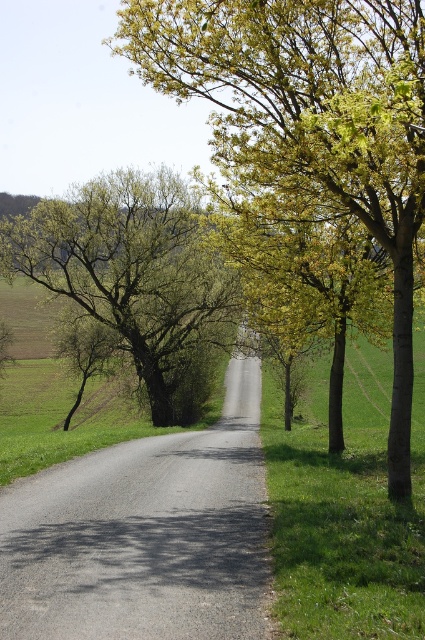
Which is above, green leafy tree at center or green leafy tree at left?

green leafy tree at center

Can you confirm if green leafy tree at center is positioned to the left of green leafy tree at left?

No, green leafy tree at center is not to the left of green leafy tree at left.

Where is `green leafy tree at center`? This screenshot has width=425, height=640. green leafy tree at center is located at coordinates (309, 122).